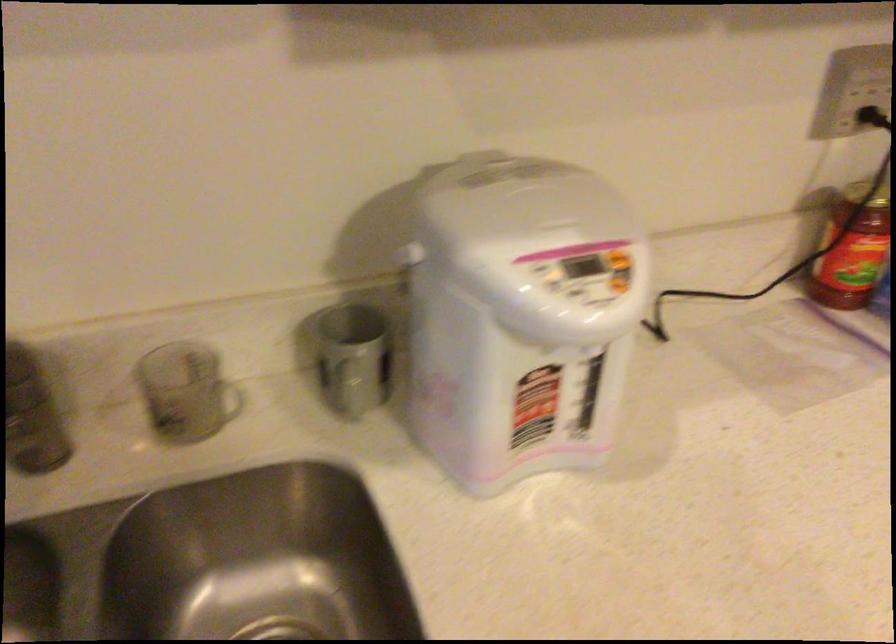
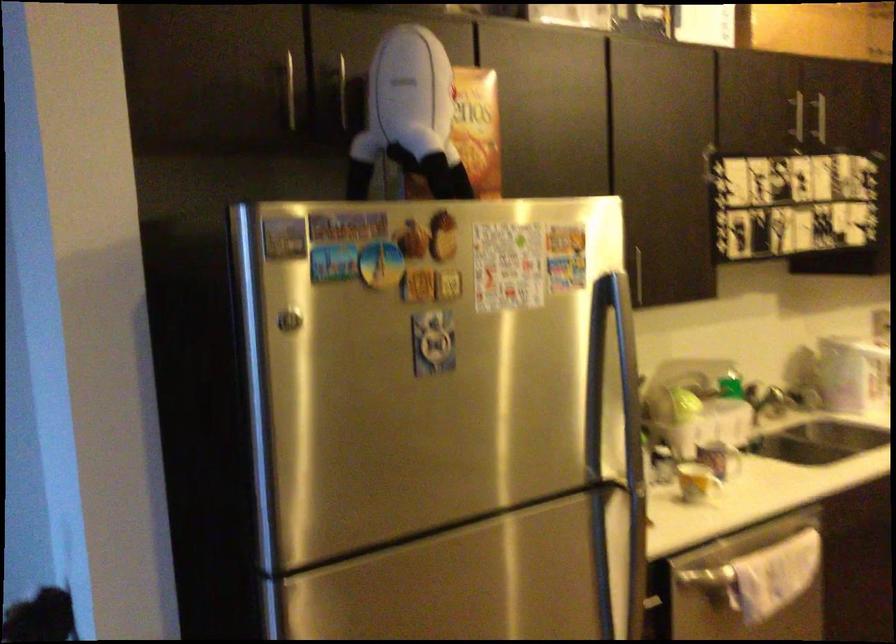
Find the pixel in the second image that matches the point at 495,386 in the first image.

(876, 375)